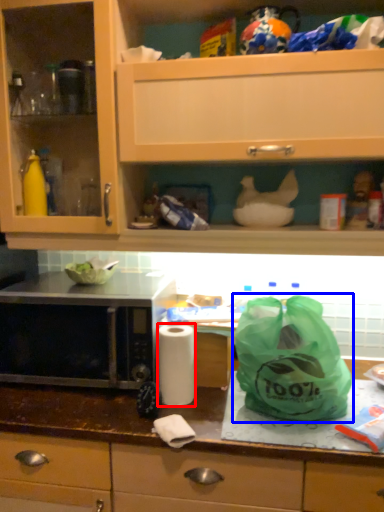
Question: Which object appears farthest to the camera in this image, paper towel (highlighted by a red box) or plastic bag (highlighted by a blue box)?

Choices:
 (A) paper towel
 (B) plastic bag

Answer: (A)